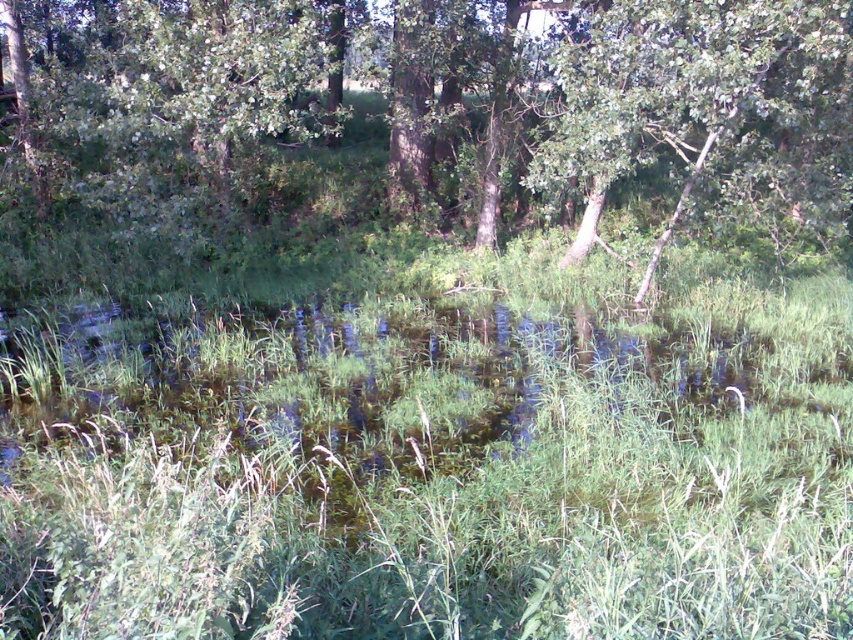
Based on the photo, does green leafy tree at center lie behind green leafy tree at upper center?

Yes, it is behind green leafy tree at upper center.

Who is lower down, green leafy tree at center or green leafy tree at upper center?

Positioned lower is green leafy tree at upper center.

I want to click on green leafy tree at center, so click(430, 109).